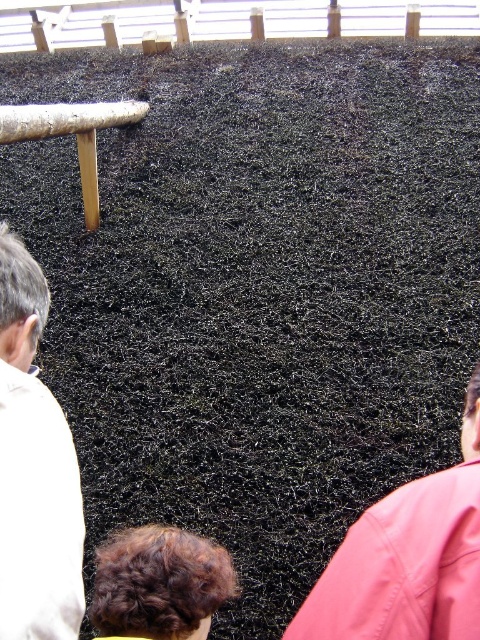
Does white fabric shirt at left have a smaller size compared to pink fabric at lower right?

Actually, white fabric shirt at left might be larger than pink fabric at lower right.

Is white fabric shirt at left positioned at the back of pink fabric at lower right?

No, white fabric shirt at left is in front of pink fabric at lower right.

Does point (8, 618) come in front of point (385, 588)?

Yes.

Where is `white fabric shirt at left`? This screenshot has width=480, height=640. white fabric shirt at left is located at coordinates (34, 468).

Who is higher up, pink fabric at lower right or brown curly hair at lower center?

pink fabric at lower right is above.

Does pink fabric at lower right have a larger size compared to brown curly hair at lower center?

Yes.

Identify the location of pink fabric at lower right. (408, 557).

This screenshot has width=480, height=640. I want to click on pink fabric at lower right, so click(408, 557).

Can you confirm if white fabric shirt at left is shorter than brown curly hair at lower center?

In fact, white fabric shirt at left may be taller than brown curly hair at lower center.

Describe the element at coordinates (34, 468) in the screenshot. Image resolution: width=480 pixels, height=640 pixels. I see `white fabric shirt at left` at that location.

This screenshot has width=480, height=640. Find the location of `white fabric shirt at left`. white fabric shirt at left is located at coordinates (34, 468).